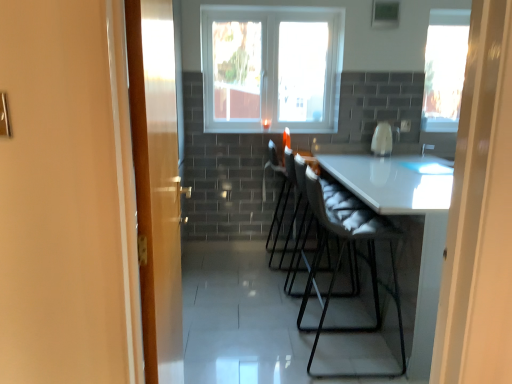
At what (x,y) coordinates should I click in order to perform the action: click on vacant space behind white fabric chair at center, positioned as the second chair in back-to-front order. Please return your answer as a coordinate pair (x, y). The width and height of the screenshot is (512, 384). Looking at the image, I should click on click(x=318, y=316).